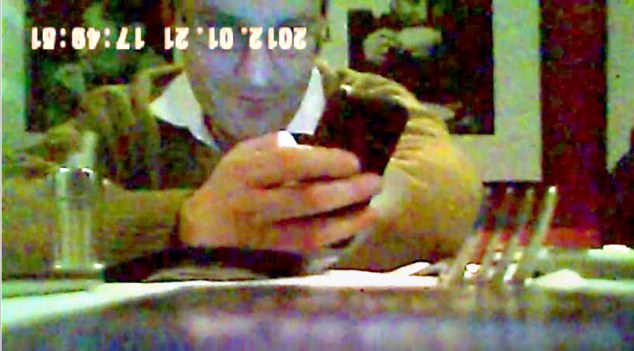
Identify the location of picture. This screenshot has height=351, width=634. (467, 58).